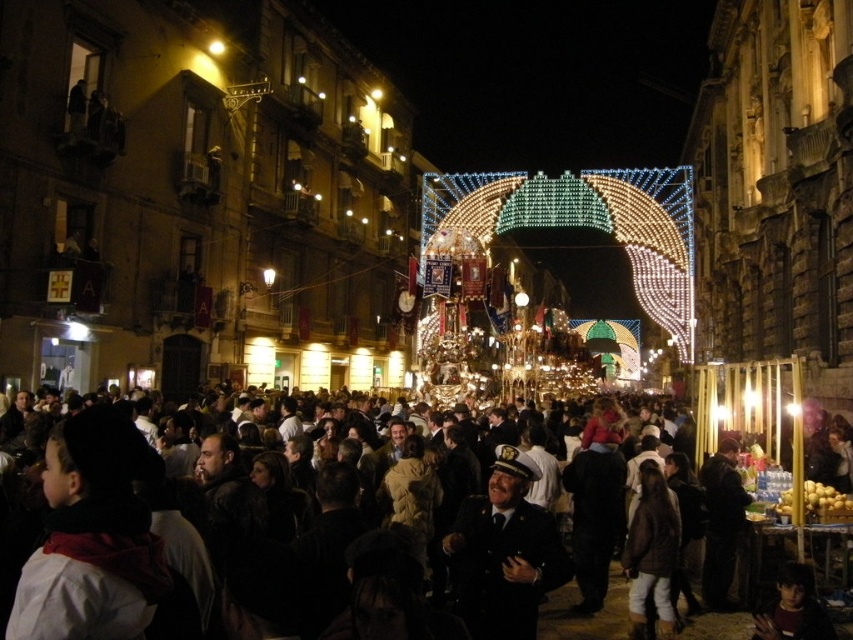
Question: Which point is closer to the camera taking this photo?

Choices:
 (A) pos(552,564)
 (B) pos(834,547)

Answer: (A)

Question: Is black uniform at center thinner than dark brown fabric crowd at center?

Choices:
 (A) yes
 (B) no

Answer: (A)

Question: Is black uniform at center to the right of dark brown fabric crowd at center from the viewer's perspective?

Choices:
 (A) no
 (B) yes

Answer: (B)

Question: Which object is closer to the camera taking this photo?

Choices:
 (A) dark brown fabric crowd at center
 (B) black uniform at center

Answer: (A)

Question: Can you confirm if black uniform at center is positioned to the left of dark brown fabric crowd at center?

Choices:
 (A) yes
 (B) no

Answer: (B)